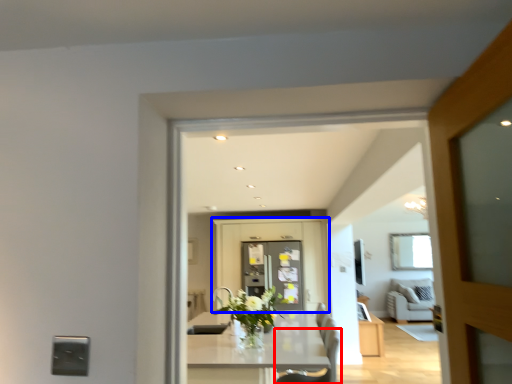
Question: Which point is closer to the camera, chair (highlighted by a red box) or cabinetry (highlighted by a blue box)?

Choices:
 (A) chair
 (B) cabinetry

Answer: (A)